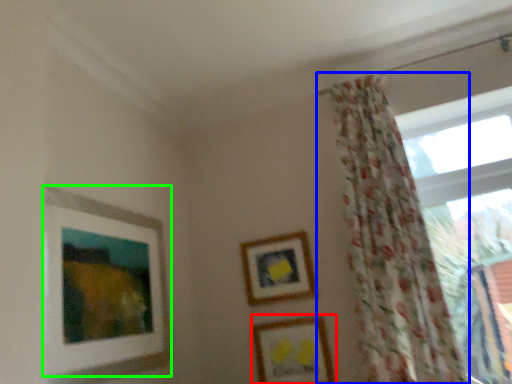
Question: Which object is the farthest from picture frame (highlighted by a red box)? Choose among these: curtain (highlighted by a blue box) or picture frame (highlighted by a green box).

Choices:
 (A) curtain
 (B) picture frame

Answer: (B)